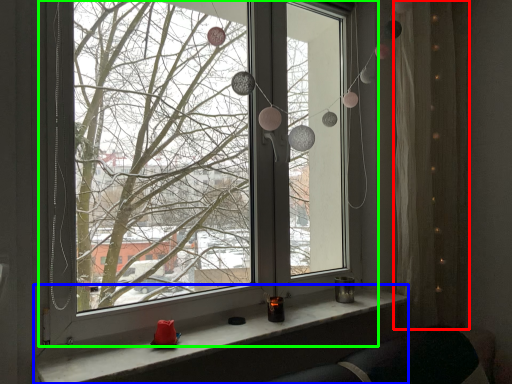
Question: Which object is positioned farthest from curtain (highlighted by a red box)? Select from window sill (highlighted by a blue box) and window (highlighted by a green box).

Choices:
 (A) window sill
 (B) window

Answer: (B)